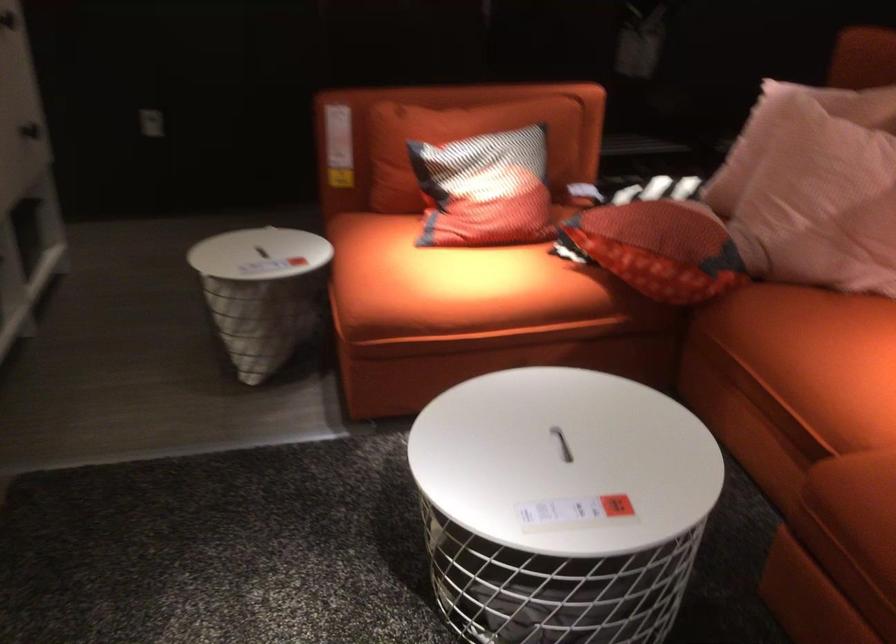
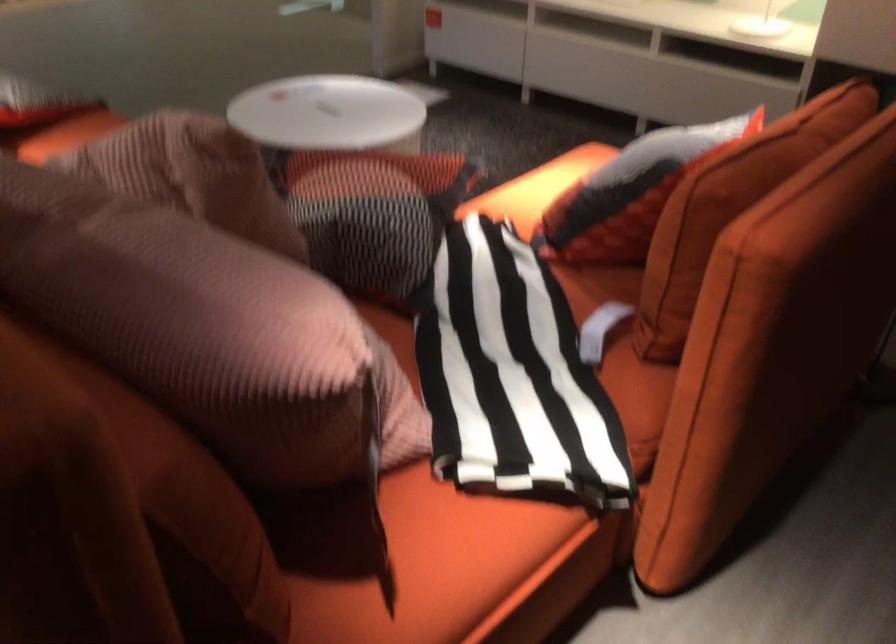
Locate, in the second image, the point that corresponds to (x=647, y=196) in the first image.

(512, 375)